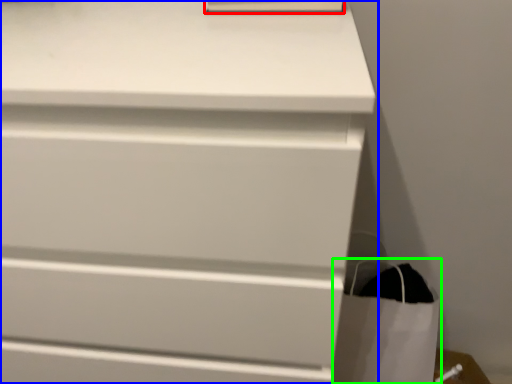
Question: Which object is the farthest from paperback book (highlighted by a red box)? Choose among these: chest of drawers (highlighted by a blue box) or shopping bag (highlighted by a green box).

Choices:
 (A) chest of drawers
 (B) shopping bag

Answer: (B)